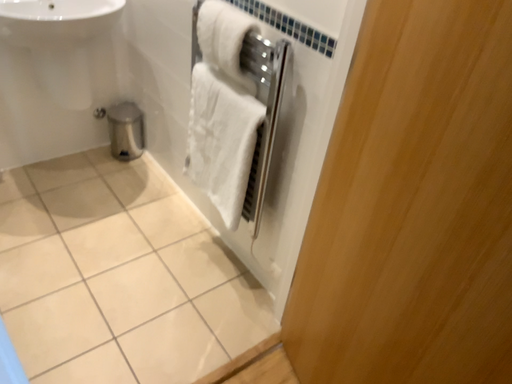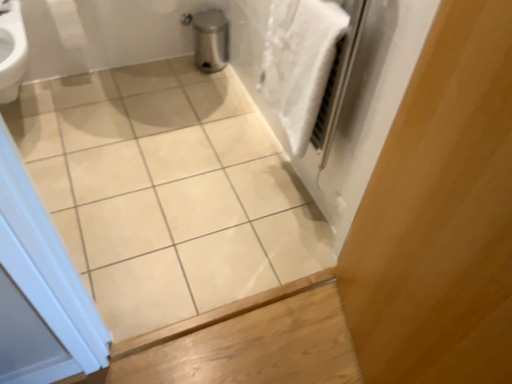
Question: Which way did the camera rotate in the video?

Choices:
 (A) rotated downward
 (B) rotated upward

Answer: (A)